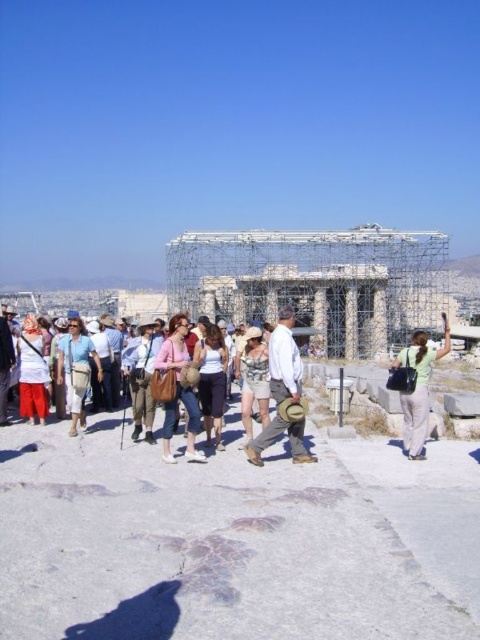
Question: Where is green fabric bag at center located in relation to white matte shorts at center in the image?

Choices:
 (A) left
 (B) right

Answer: (B)

Question: Which point is closer to the camera taking this photo?

Choices:
 (A) (183, 404)
 (B) (29, 387)

Answer: (A)

Question: Can you confirm if matte blue shirt at center is positioned above matte white shirt at center?

Choices:
 (A) no
 (B) yes

Answer: (A)

Question: Is matte brown hat at center below printed cotton dress at center?

Choices:
 (A) yes
 (B) no

Answer: (B)

Question: Which of the following is the closest to the observer?

Choices:
 (A) matte brown hat at center
 (B) matte blue shirt at center
 (C) white matte shorts at center
 (D) printed cotton dress at center

Answer: (A)

Question: Which object appears farthest from the camera in this image?

Choices:
 (A) matte brown hat at center
 (B) matte white shirt at center

Answer: (B)